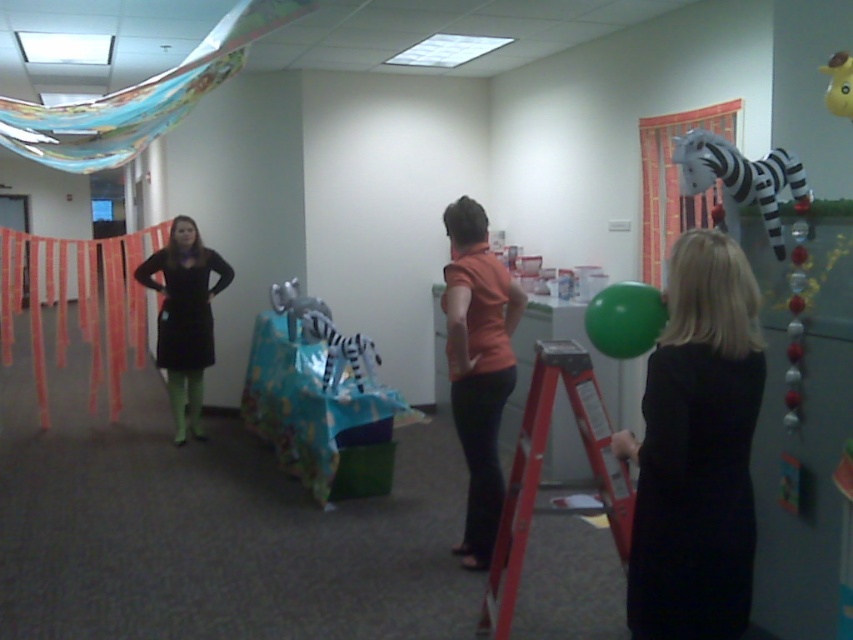
Which is in front, point (704, 300) or point (160, 259)?

Point (704, 300) is in front.

Can you confirm if black matte dress at right is smaller than black matte dress at left?

Correct, black matte dress at right occupies less space than black matte dress at left.

Is point (712, 342) closer to viewer compared to point (164, 352)?

Yes, point (712, 342) is closer to viewer.

Locate an element on the screen. Image resolution: width=853 pixels, height=640 pixels. black matte dress at right is located at coordinates (697, 449).

Does black matte dress at left have a smaller size compared to white striped plush zebra at center?

No.

Does black matte dress at left appear on the right side of white striped plush zebra at center?

No, black matte dress at left is not to the right of white striped plush zebra at center.

Is point (209, 336) positioned after point (373, 372)?

Yes.

Where is `black matte dress at left`? The image size is (853, 640). black matte dress at left is located at coordinates (184, 317).

Is plush fabric zebra at right to the left of green rubber balloon at right from the viewer's perspective?

Incorrect, plush fabric zebra at right is not on the left side of green rubber balloon at right.

Between plush fabric zebra at right and green rubber balloon at right, which one appears on the left side from the viewer's perspective?

green rubber balloon at right

Image resolution: width=853 pixels, height=640 pixels. Describe the element at coordinates (740, 179) in the screenshot. I see `plush fabric zebra at right` at that location.

The width and height of the screenshot is (853, 640). Identify the location of plush fabric zebra at right. (740, 179).